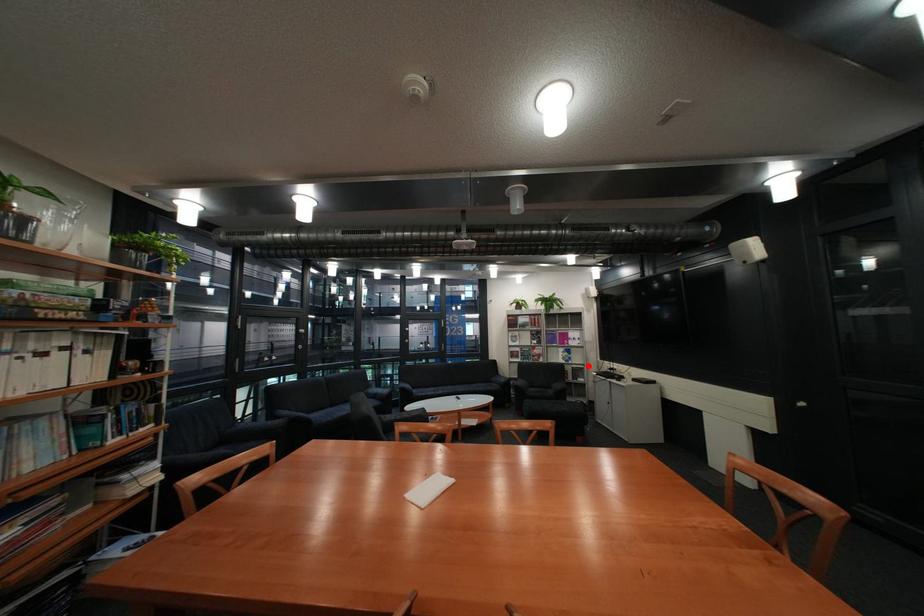
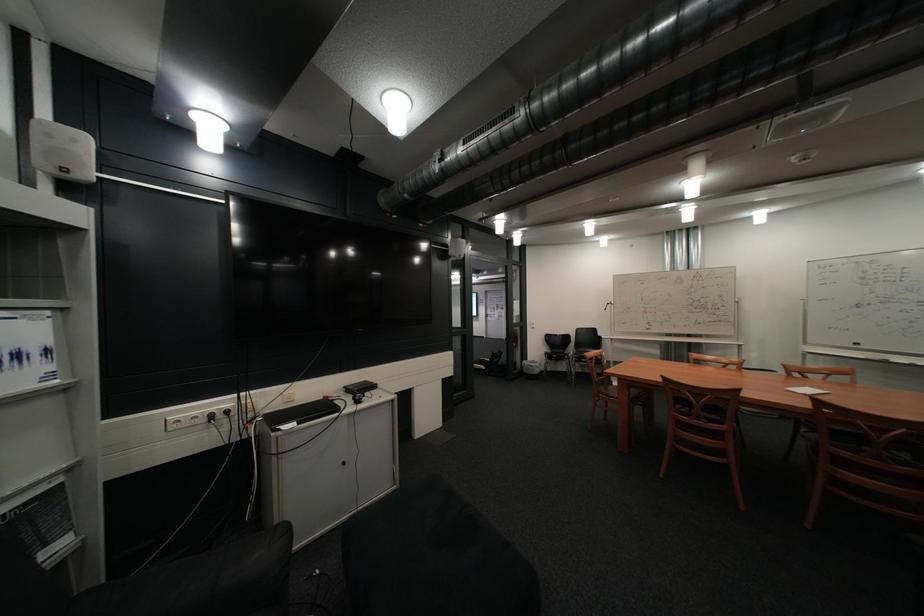
Where in the second image is the point corresponding to the highlighted location from the first image?

(10, 514)